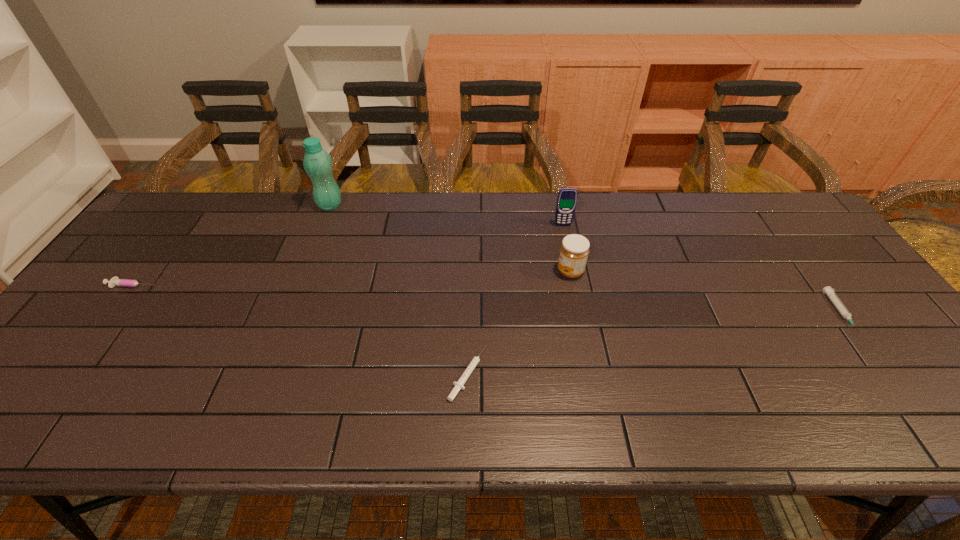
Find the location of a particular element. Image resolution: width=960 pixels, height=540 pixels. vacant space that's between the fifth nearest object and the leftmost object is located at coordinates (348, 255).

This screenshot has height=540, width=960. I want to click on vacant area that lies between the third tallest object and the second object from left to right, so click(x=450, y=238).

At what (x,y) coordinates should I click in order to perform the action: click on free space between the leftmost syringe and the second farthest object. Please return your answer as a coordinate pair (x, y). Looking at the image, I should click on (348, 255).

Find the location of `free area in between the second syringe from right to left and the jam`. free area in between the second syringe from right to left and the jam is located at coordinates (519, 322).

The width and height of the screenshot is (960, 540). I want to click on empty location between the second tallest object and the fifth object from right to left, so click(x=446, y=215).

You are a GUI agent. You are given a task and a screenshot of the screen. Output one action in this format:
    pyautogui.click(x=<x>, y=<y>)
    Task: Click on the vacant region between the fifth nearest object and the rightmost object
    This screenshot has width=960, height=540.
    Given the screenshot: What is the action you would take?
    pyautogui.click(x=702, y=269)

Identify the location of unoccupied position between the jam and the rightmost syringe. (706, 292).

The height and width of the screenshot is (540, 960). What are the coordinates of `vacant area between the jam and the fifth object from right to left` in the screenshot? It's located at (450, 238).

Locate an element on the screen. Image resolution: width=960 pixels, height=540 pixels. vacant space that's between the rightmost syringe and the fifth nearest object is located at coordinates (702, 269).

Locate which object ranks in proximity to the third object from left to right. Please provide its 2D coordinates. Your answer should be formatted as a tuple, i.e. [(x, y)], where the tuple contains the x and y coordinates of a point satisfying the conditions above.

[(574, 250)]